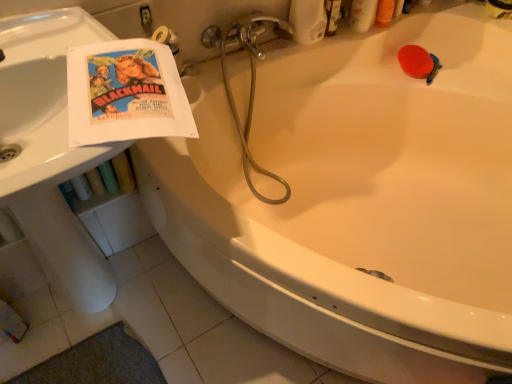
Find the location of a particular element. white glossy bathtub at upper center is located at coordinates (358, 200).

Describe the element at coordinates (358, 200) in the screenshot. This screenshot has width=512, height=384. I see `white glossy bathtub at upper center` at that location.

This screenshot has width=512, height=384. What are the coordinates of `white glossy bathtub at upper center` in the screenshot? It's located at (358, 200).